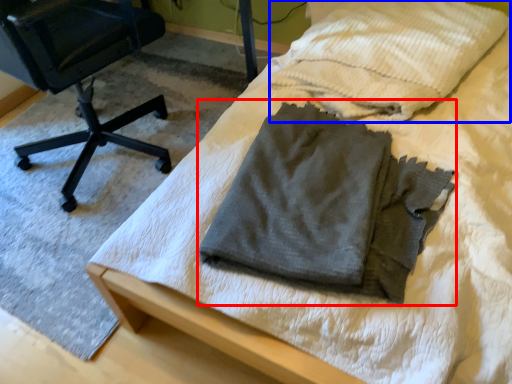
Question: Among these objects, which one is farthest to the camera, laundry (highlighted by a red box) or cloth (highlighted by a blue box)?

Choices:
 (A) laundry
 (B) cloth

Answer: (B)